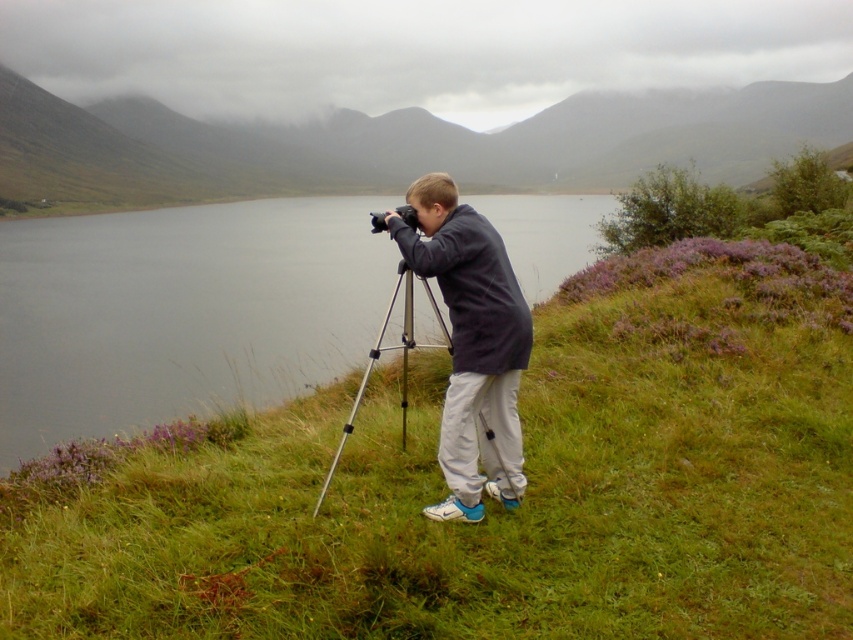
Question: Does green grassy at center have a lesser width compared to silver metallic tripod at center?

Choices:
 (A) no
 (B) yes

Answer: (A)

Question: Considering the real-world distances, which object is closest to the dark gray jacket at center?

Choices:
 (A) smooth gray water at center
 (B) purple heather at center

Answer: (A)

Question: Estimate the real-world distances between objects in this image. Which object is closer to the green grassy at center?

Choices:
 (A) smooth gray water at center
 (B) silver metallic tripod at center

Answer: (B)

Question: In this image, where is green grassy at center located relative to silver metallic tripod at center?

Choices:
 (A) above
 (B) below

Answer: (A)

Question: Can you confirm if smooth gray water at center is positioned above purple heather at center?

Choices:
 (A) no
 (B) yes

Answer: (A)

Question: Estimate the real-world distances between objects in this image. Which object is farther from the dark gray jacket at center?

Choices:
 (A) green grassy at center
 (B) smooth gray water at center
 (C) black plastic camera at center
 (D) silver metallic tripod at center

Answer: (B)